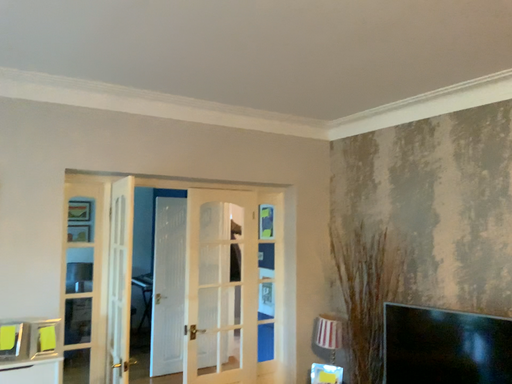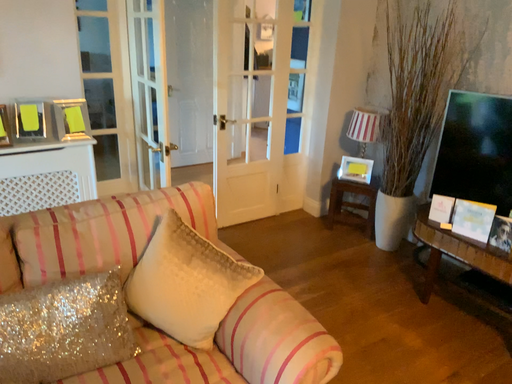
Question: Which way did the camera rotate in the video?

Choices:
 (A) rotated downward
 (B) rotated upward

Answer: (A)